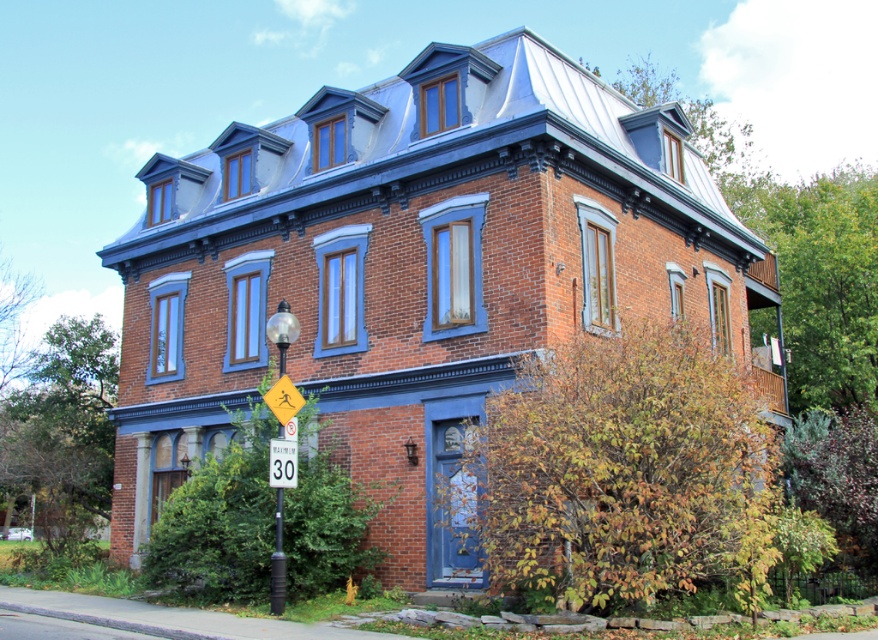
Question: Which point is closer to the camera?

Choices:
 (A) white plastic speed limit sign at center
 (B) yellow plastic sign at lower center

Answer: (B)

Question: Does yellow plastic sign at lower center have a smaller size compared to white plastic speed limit sign at center?

Choices:
 (A) no
 (B) yes

Answer: (B)

Question: Can you confirm if yellow plastic sign at lower center is positioned to the left of white plastic speed limit sign at center?

Choices:
 (A) no
 (B) yes

Answer: (A)

Question: Which point is closer to the camera taking this photo?

Choices:
 (A) (282, 368)
 (B) (283, 477)

Answer: (B)

Question: Which point appears closest to the camera in this image?

Choices:
 (A) (277, 611)
 (B) (277, 442)

Answer: (A)

Question: Does yellow plastic sign at lower center have a lesser width compared to white plastic speed limit sign at center?

Choices:
 (A) yes
 (B) no

Answer: (A)